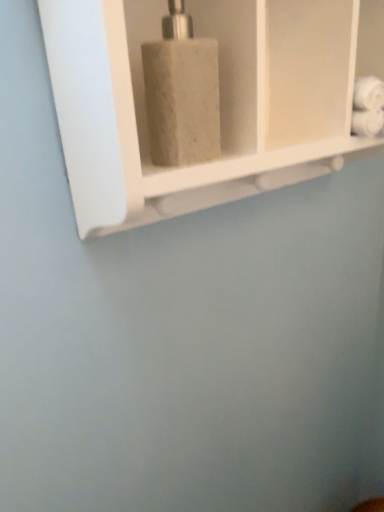
Question: Should I look upward or downward to see matte gray soap dispenser at center?

Choices:
 (A) down
 (B) up

Answer: (B)

Question: Is white marble soap dispenser at center thinner than matte gray soap dispenser at center?

Choices:
 (A) no
 (B) yes

Answer: (A)

Question: From a real-world perspective, is white marble soap dispenser at center on matte gray soap dispenser at center?

Choices:
 (A) no
 (B) yes

Answer: (A)

Question: Can you confirm if white marble soap dispenser at center is wider than matte gray soap dispenser at center?

Choices:
 (A) yes
 (B) no

Answer: (A)

Question: Is white marble soap dispenser at center far away from matte gray soap dispenser at center?

Choices:
 (A) yes
 (B) no

Answer: (B)

Question: From the image's perspective, would you say white marble soap dispenser at center is positioned over matte gray soap dispenser at center?

Choices:
 (A) yes
 (B) no

Answer: (A)

Question: Can you confirm if white marble soap dispenser at center is taller than matte gray soap dispenser at center?

Choices:
 (A) no
 (B) yes

Answer: (B)

Question: From the image's perspective, is matte gray soap dispenser at center below white marble soap dispenser at center?

Choices:
 (A) no
 (B) yes

Answer: (B)

Question: Is matte gray soap dispenser at center aimed at white marble soap dispenser at center?

Choices:
 (A) yes
 (B) no

Answer: (A)

Question: Does matte gray soap dispenser at center appear on the right side of white marble soap dispenser at center?

Choices:
 (A) no
 (B) yes

Answer: (A)

Question: Is matte gray soap dispenser at center at the left side of white marble soap dispenser at center?

Choices:
 (A) yes
 (B) no

Answer: (A)

Question: Is matte gray soap dispenser at center positioned before white marble soap dispenser at center?

Choices:
 (A) yes
 (B) no

Answer: (B)

Question: Is there a large distance between matte gray soap dispenser at center and white marble soap dispenser at center?

Choices:
 (A) no
 (B) yes

Answer: (A)

Question: From the image's perspective, is white marble soap dispenser at center above or below matte gray soap dispenser at center?

Choices:
 (A) above
 (B) below

Answer: (A)